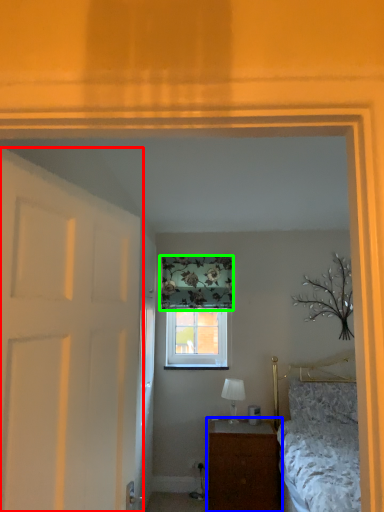
Question: Which object is positioned farthest from door (highlighted by a red box)? Select from nightstand (highlighted by a blue box) and curtain (highlighted by a green box).

Choices:
 (A) nightstand
 (B) curtain

Answer: (B)